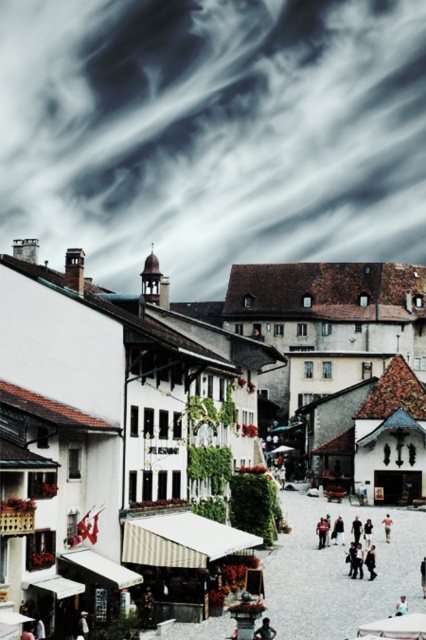
In the scene shown: You are standing in the European town square and want to take a photo that includes both the point at coordinates (253, 132) and the point at (268, 634). Which point should you focus on first to ensure both are in focus?

You should focus on the point at coordinates (253, 132) first because it is closer to the camera than the point at (268, 634). This ensures that both points will be in focus as the closer point sets the focal plane.